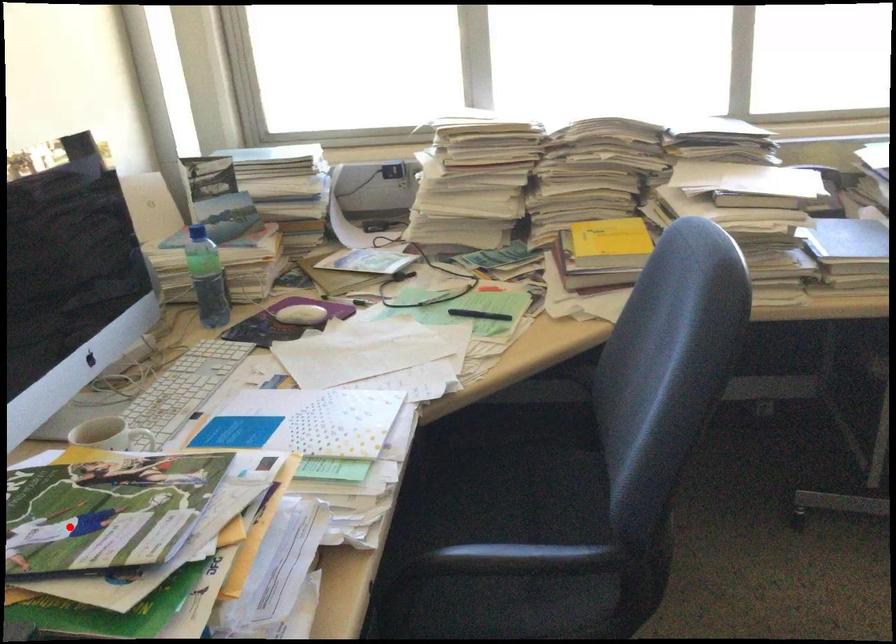
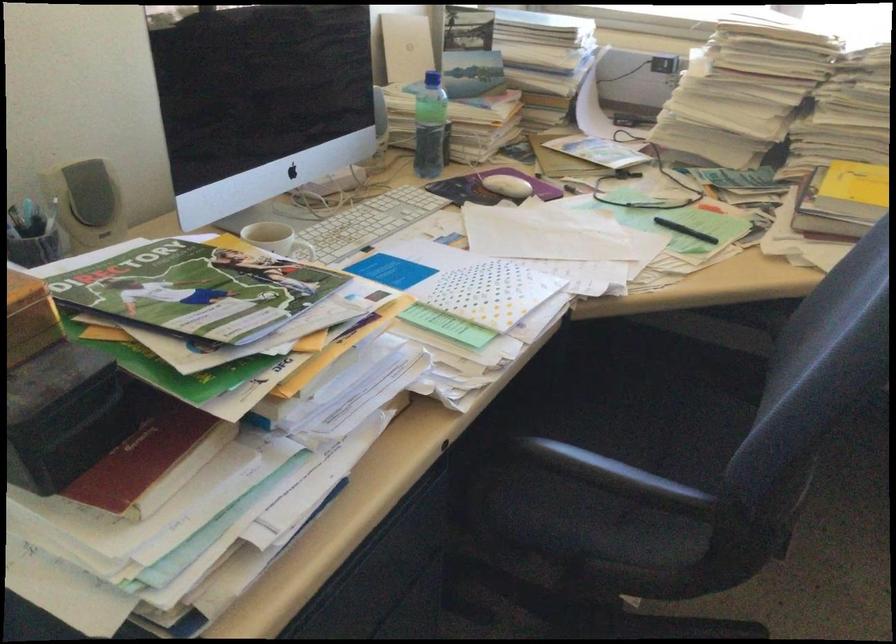
In the second image, find the point that corresponds to the highlighted location in the first image.

(195, 290)